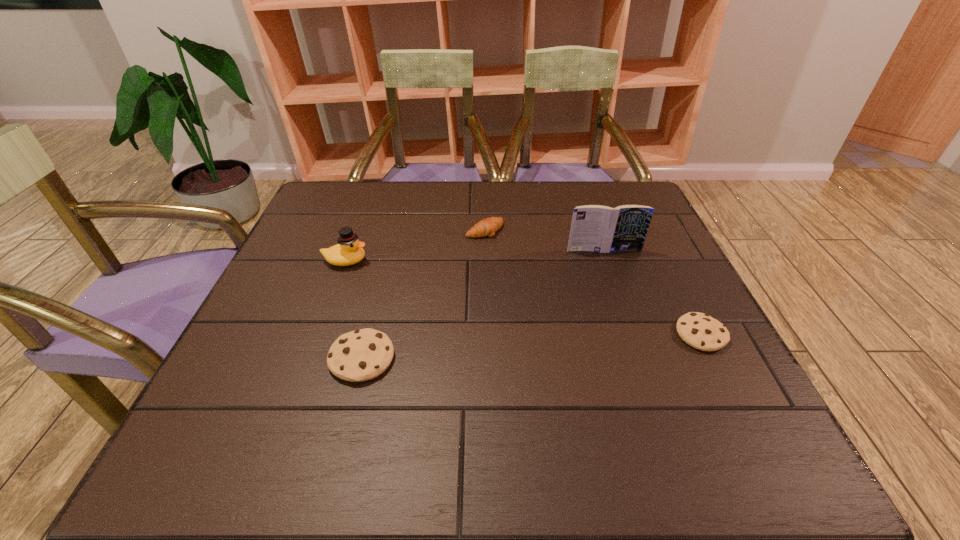
To make them evenly spaced by inserting another cookie among them, please locate a free space for this new cookie. Please provide its 2D coordinates. Your answer should be formatted as a tuple, i.e. [(x, y)], where the tuple contains the x and y coordinates of a point satisfying the conditions above.

[(536, 346)]